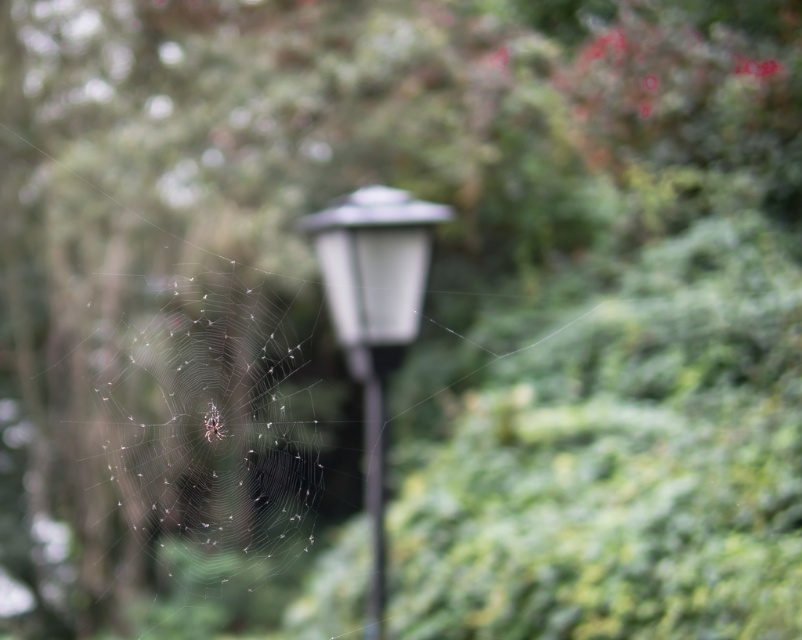
Question: Is translucent silk web at center above white glossy street light at center?

Choices:
 (A) yes
 (B) no

Answer: (B)

Question: Based on their relative distances, which object is farther from the white glossy street light at center?

Choices:
 (A) translucent silk web at center
 (B) black glass pole at center

Answer: (A)

Question: Which object is closer to the camera taking this photo?

Choices:
 (A) black glass pole at center
 (B) translucent silk spider at center
 (C) translucent silk web at center

Answer: (A)

Question: Which point is farther to the camera?

Choices:
 (A) translucent silk web at center
 (B) translucent silk spider at center
 (C) white glossy street light at center
 (D) black glass pole at center

Answer: (B)

Question: In this image, where is black glass pole at center located relative to translucent silk spider at center?

Choices:
 (A) right
 (B) left

Answer: (A)

Question: Is translucent silk web at center in front of translucent silk spider at center?

Choices:
 (A) yes
 (B) no

Answer: (A)